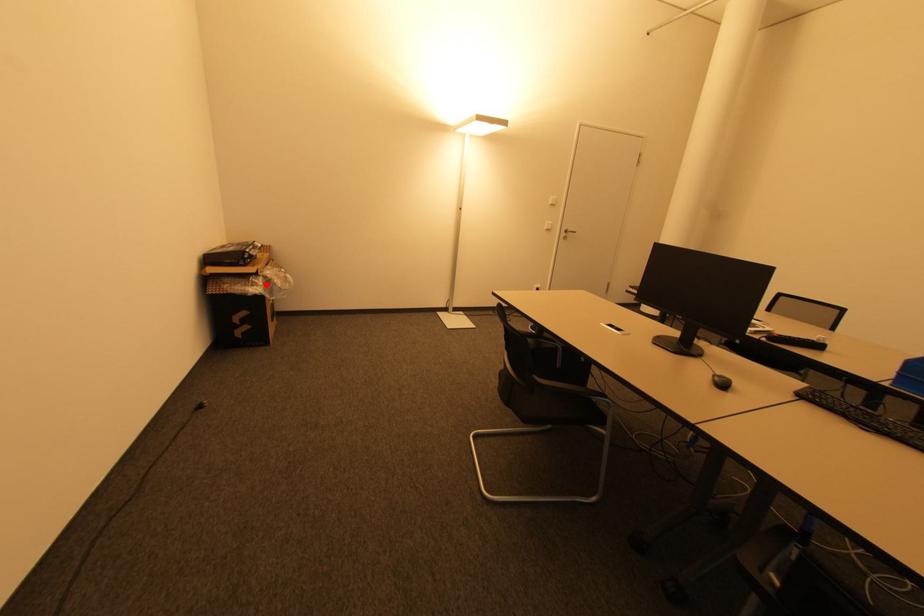
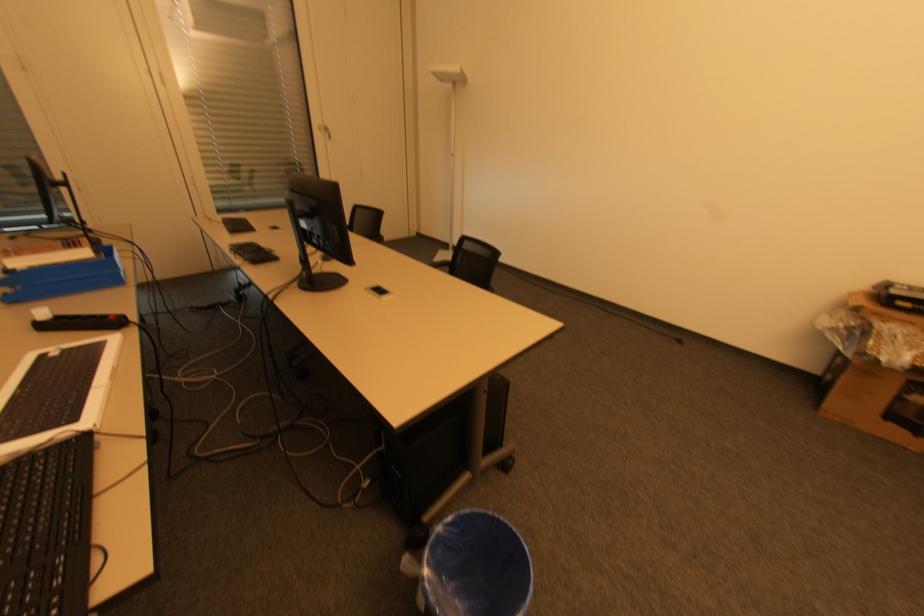
Find the pixel in the second image that matches the highlighted location in the first image.

(850, 328)